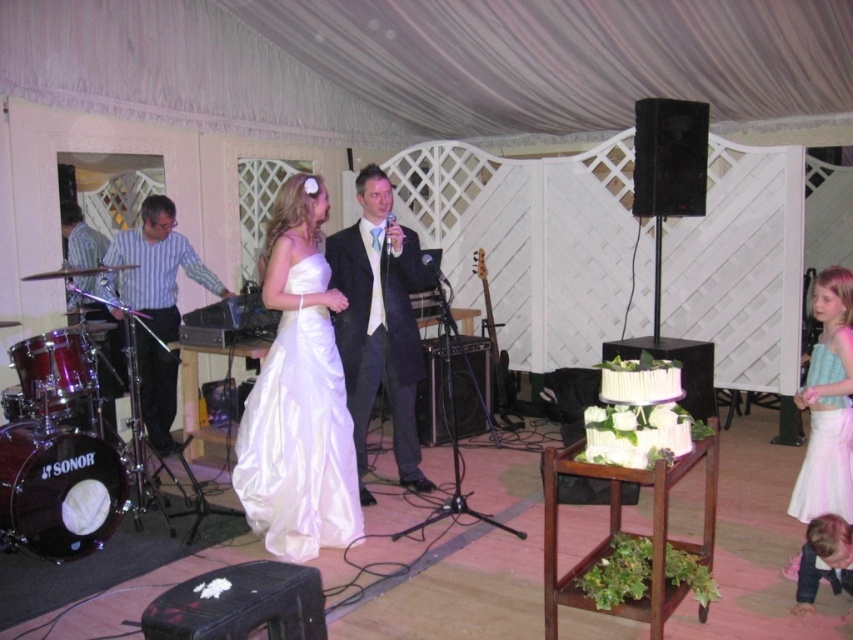
You are standing at the center of the tented venue and notice a point marked at coordinates (300, 394). What object is located at that specific point?

The satin white dress at center is located at point (300, 394).

You are a photographer at the wedding reception. You need to capture a photo of both the satin white dress at center and the white satin dress at center. Which dress is on the right side when facing the stage?

The satin white dress at center is positioned on the right side of the white satin dress at center, so when facing the stage, the satin white dress at center is on the right.

In the wedding reception scene, there is a point marked at coordinates (300, 394). Which object from the list below is located at this position? Choose from the objects listed below. Objects available are satin white dress at center, SONOR drum set at left, and the couple on the stage.

The point at coordinates (300, 394) corresponds to the satin white dress at center.